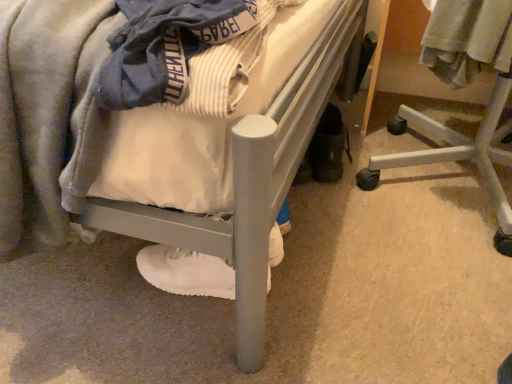
Question: Is light gray cotton shirt at upper right oriented away from matte gray bed at center?

Choices:
 (A) no
 (B) yes

Answer: (B)

Question: Is light gray cotton shirt at upper right next to matte gray bed at center and touching it?

Choices:
 (A) no
 (B) yes

Answer: (A)

Question: From a real-world perspective, is light gray cotton shirt at upper right physically below matte gray bed at center?

Choices:
 (A) no
 (B) yes

Answer: (A)

Question: Is light gray cotton shirt at upper right outside matte gray bed at center?

Choices:
 (A) no
 (B) yes

Answer: (B)

Question: Can you confirm if light gray cotton shirt at upper right is positioned to the left of matte gray bed at center?

Choices:
 (A) yes
 (B) no

Answer: (B)

Question: Is light gray cotton shirt at upper right at the right side of matte gray bed at center?

Choices:
 (A) no
 (B) yes

Answer: (B)

Question: Are white plastic chair at lower right and matte gray bed at center located far from each other?

Choices:
 (A) yes
 (B) no

Answer: (B)

Question: Considering the relative sizes of white plastic chair at lower right and matte gray bed at center in the image provided, is white plastic chair at lower right shorter than matte gray bed at center?

Choices:
 (A) yes
 (B) no

Answer: (A)

Question: Is white plastic chair at lower right directly adjacent to matte gray bed at center?

Choices:
 (A) yes
 (B) no

Answer: (B)

Question: Can you confirm if white plastic chair at lower right is bigger than matte gray bed at center?

Choices:
 (A) yes
 (B) no

Answer: (B)

Question: Is white plastic chair at lower right positioned in front of matte gray bed at center?

Choices:
 (A) no
 (B) yes

Answer: (A)

Question: Could you tell me if white plastic chair at lower right is facing matte gray bed at center?

Choices:
 (A) no
 (B) yes

Answer: (A)

Question: Is white matte sneaker at lower center in contact with white plastic chair at lower right?

Choices:
 (A) yes
 (B) no

Answer: (B)